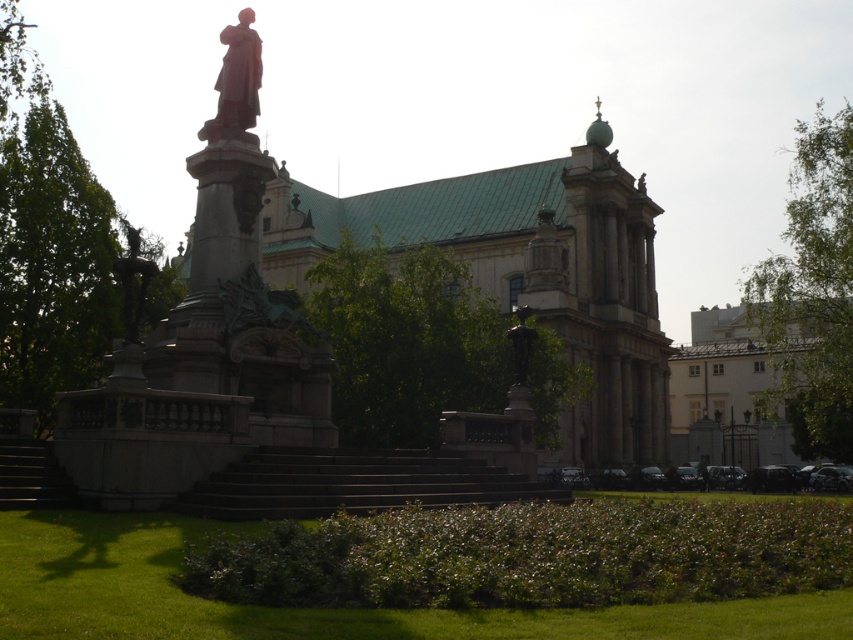
Can you confirm if green leafy tree at left is shorter than polished bronze statue at upper center?

In fact, green leafy tree at left may be taller than polished bronze statue at upper center.

Does green leafy tree at left have a smaller size compared to polished bronze statue at upper center?

Incorrect, green leafy tree at left is not smaller in size than polished bronze statue at upper center.

Which is in front, point (65, 371) or point (253, 80)?

Positioned in front is point (253, 80).

Where is `green leafy tree at left`? Image resolution: width=853 pixels, height=640 pixels. green leafy tree at left is located at coordinates (51, 262).

This screenshot has width=853, height=640. Identify the location of green leafy tree at center. (405, 340).

I want to click on green leafy tree at center, so click(405, 340).

Does green leafy tree at upper right have a smaller size compared to polished bronze statue at upper center?

No.

Which is in front, point (838, 161) or point (230, 81)?

Point (230, 81)

This screenshot has height=640, width=853. I want to click on green leafy tree at upper right, so click(811, 291).